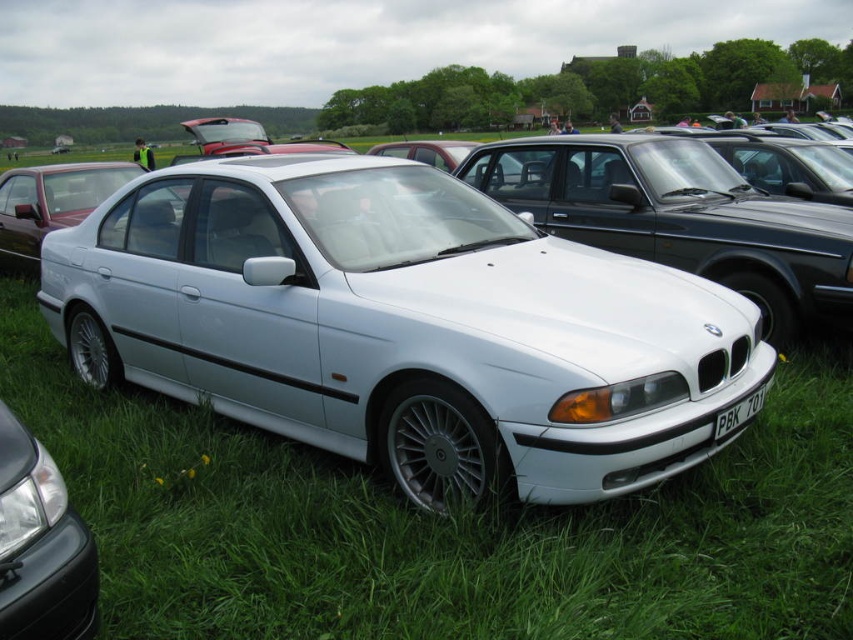
Based on the photo, you are a photographer at an outdoor car event. You need to position a tripod to capture both the white metallic sedan at center and the satin black headlight at lower left in the same frame. Considering their sizes, which object should be placed closer to the camera to ensure both fit in the shot?

The white metallic sedan at center is much taller than the satin black headlight at lower left. To fit both in the frame, the smaller satin black headlight at lower left should be placed closer to the camera while the taller white metallic sedan at center can be positioned further back.

You are at the coordinates 0,0 and want to find the white metallic sedan at center. Which direction should you move to reach it?

The white metallic sedan at center is located at point [401,326], so you should move northeast to reach it.